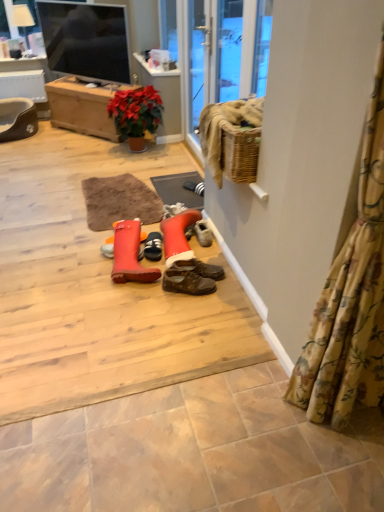
The height and width of the screenshot is (512, 384). Find the location of `unoccupied region to the right of brown leather shoes at center, the third footwear from the left`. unoccupied region to the right of brown leather shoes at center, the third footwear from the left is located at coordinates (228, 286).